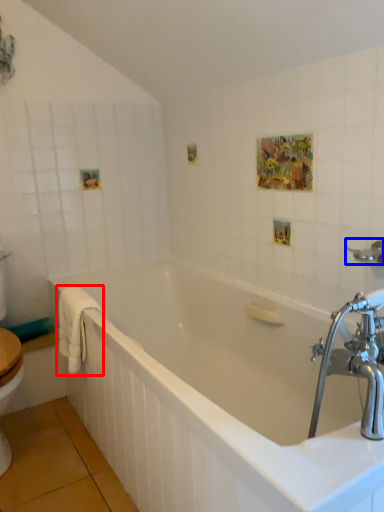
Question: Among these objects, which one is farthest to the camera, bath towel (highlighted by a red box) or shower (highlighted by a blue box)?

Choices:
 (A) bath towel
 (B) shower

Answer: (A)